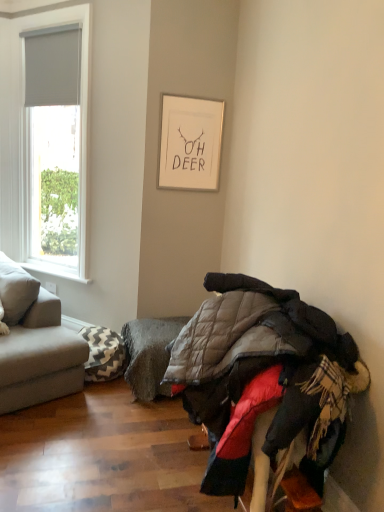
You are a GUI agent. You are given a task and a screenshot of the screen. Output one action in this format:
    pyautogui.click(x=<x>, y=<y>)
    Task: Click on the vacant space in front of gray textured footrest at lower center
    
    Given the screenshot: What is the action you would take?
    (x=127, y=423)